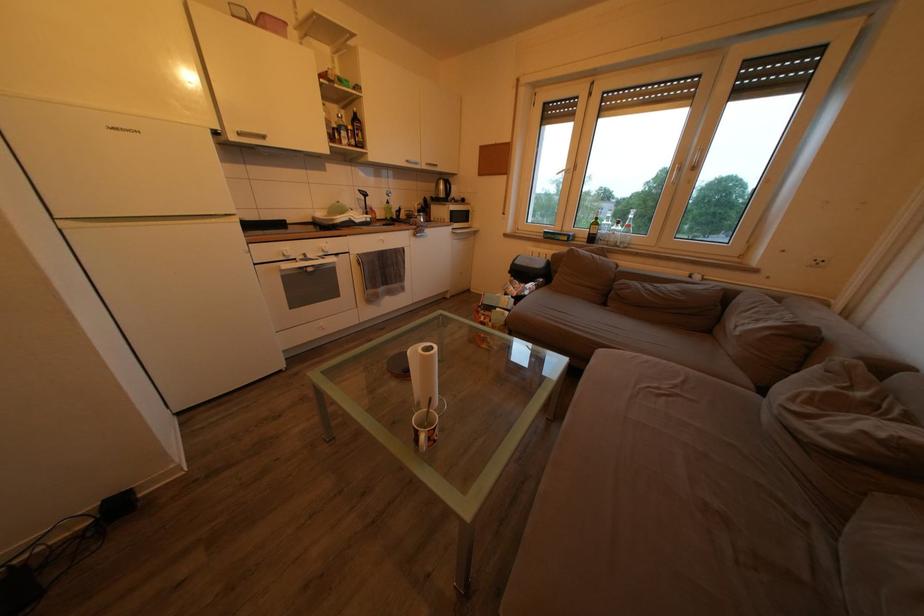
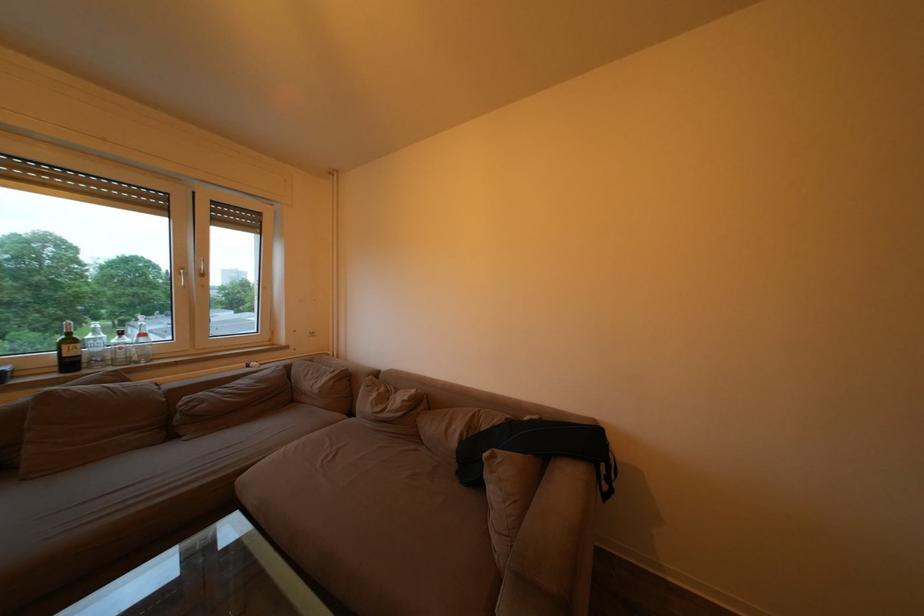
In the second image, find the point that corresponds to point (868, 400) in the first image.

(390, 395)